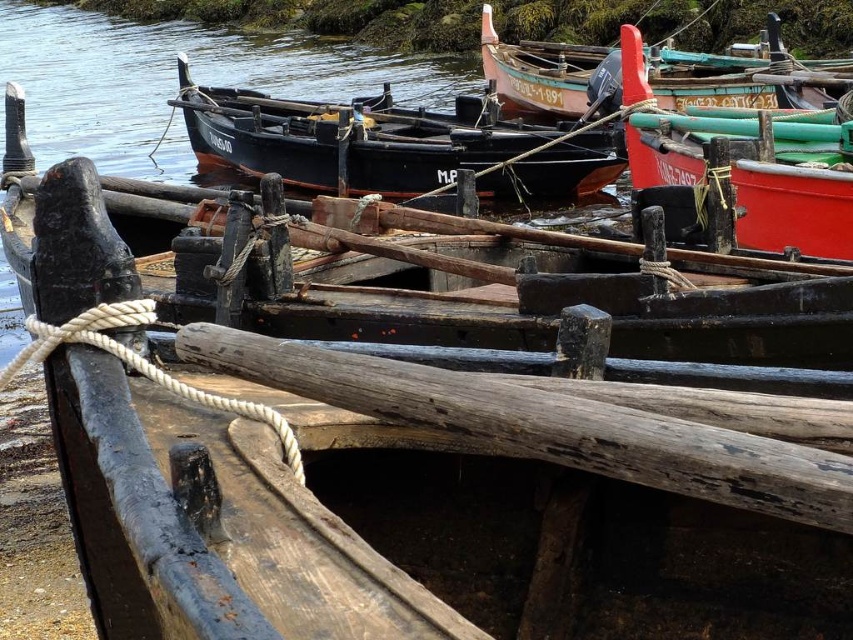
Question: Is weathered wood log at center to the left of matte black boat at center from the viewer's perspective?

Choices:
 (A) yes
 (B) no

Answer: (B)

Question: Estimate the real-world distances between objects in this image. Which object is closer to the wooden boat at upper right?

Choices:
 (A) matte black boat at center
 (B) weathered wood log at center

Answer: (A)

Question: Which object appears closest to the camera in this image?

Choices:
 (A) weathered wood log at center
 (B) red matte boat at upper right
 (C) wooden boat at upper right

Answer: (A)

Question: Can you confirm if weathered wood log at center is positioned to the left of matte black boat at center?

Choices:
 (A) yes
 (B) no

Answer: (B)

Question: Among these objects, which one is farthest from the camera?

Choices:
 (A) matte black boat at center
 (B) weathered wood log at center

Answer: (A)

Question: Where is weathered wood log at center located in relation to matte black boat at center in the image?

Choices:
 (A) above
 (B) below

Answer: (B)